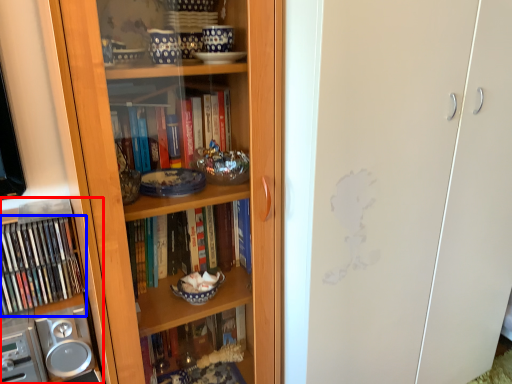
Question: Which object appears closest to the camera in this image, cabinet (highlighted by a red box) or book (highlighted by a blue box)?

Choices:
 (A) cabinet
 (B) book

Answer: (A)